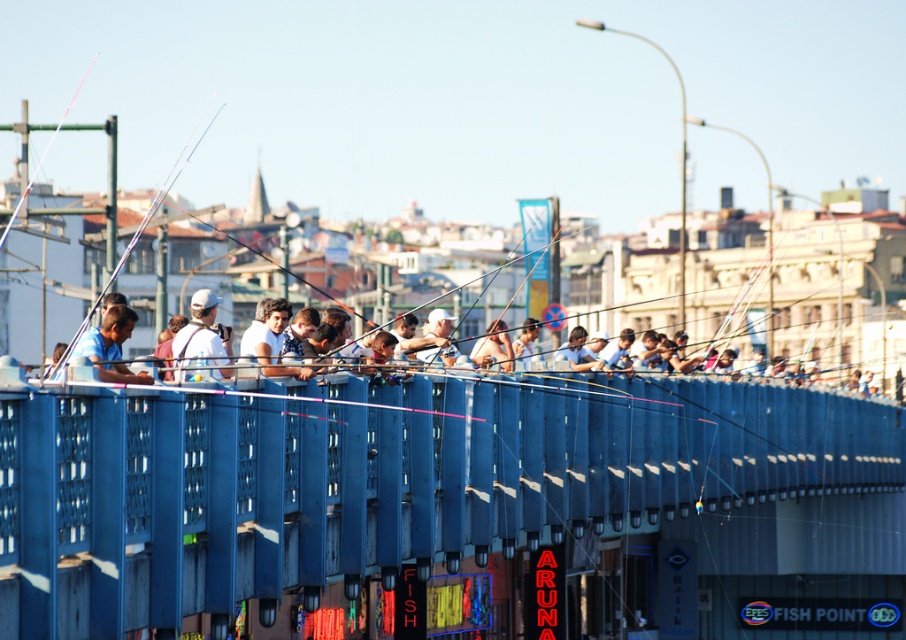
Question: Does white matte cap at center appear under metallic fishing pole at left?

Choices:
 (A) no
 (B) yes

Answer: (B)

Question: Which is nearer to the white matte cap at center?

Choices:
 (A) matte black fishing pole at upper left
 (B) blue metal fence at center
 (C) metallic fishing pole at left

Answer: (B)

Question: Considering the real-world distances, which object is farthest from the matte black fishing pole at upper left?

Choices:
 (A) light brown skin at center
 (B) metallic fishing pole at left
 (C) white matte cap at center
 (D) blue matte shirt at center

Answer: (C)

Question: Can you confirm if blue matte shirt at center is positioned below matte black fishing pole at upper left?

Choices:
 (A) yes
 (B) no

Answer: (A)

Question: Which object is closer to the camera taking this photo?

Choices:
 (A) blue metal fence at center
 (B) blue matte shirt at center
 (C) metallic fishing pole at left

Answer: (A)

Question: Does white matte cap at center have a smaller size compared to light brown skin at center?

Choices:
 (A) no
 (B) yes

Answer: (B)